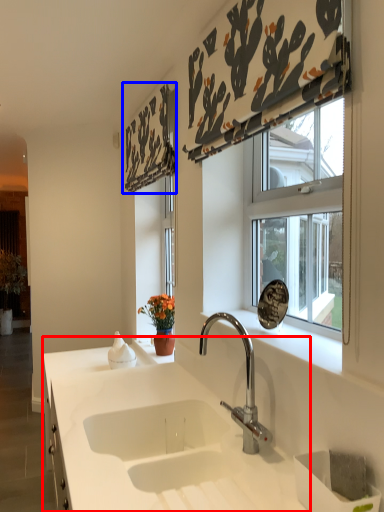
Question: Among these objects, which one is farthest to the camera, countertop (highlighted by a red box) or curtain (highlighted by a blue box)?

Choices:
 (A) countertop
 (B) curtain

Answer: (B)